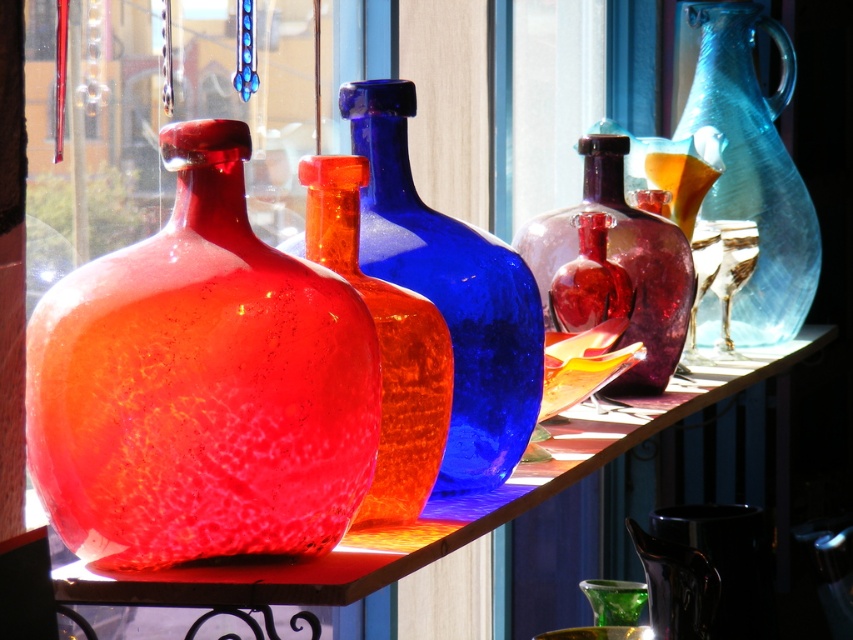
Based on the photo, you are a customer in the shop and want to pick up the matte glass vase at left and the transparent blue glass pitcher at right. Which one will you see first when looking from the front of the shelf?

The matte glass vase at left is in front of the transparent blue glass pitcher at right, so you will see the matte glass vase at left first when looking from the front of the shelf.

Consider the image. You are a customer in the shop and want to place both the crackle glass vase at center and the matte glass vase at center on your narrow shelf at home. Which vase should you choose to ensure it fits better?

The matte glass vase at center has a smaller width compared to the crackle glass vase at center, so it will fit better on the narrow shelf.

You are a customer in the shop looking to buy a vase that can hold a bouquet of flowers. The flowers require a vase that is at least 30 cm tall. You see the crackle glass vase at center and the matte glass vase at center. Which one should you choose?

The crackle glass vase at center is much taller than the matte glass vase at center, so you should choose the crackle glass vase at center to hold the bouquet of flowers as it meets the height requirement.